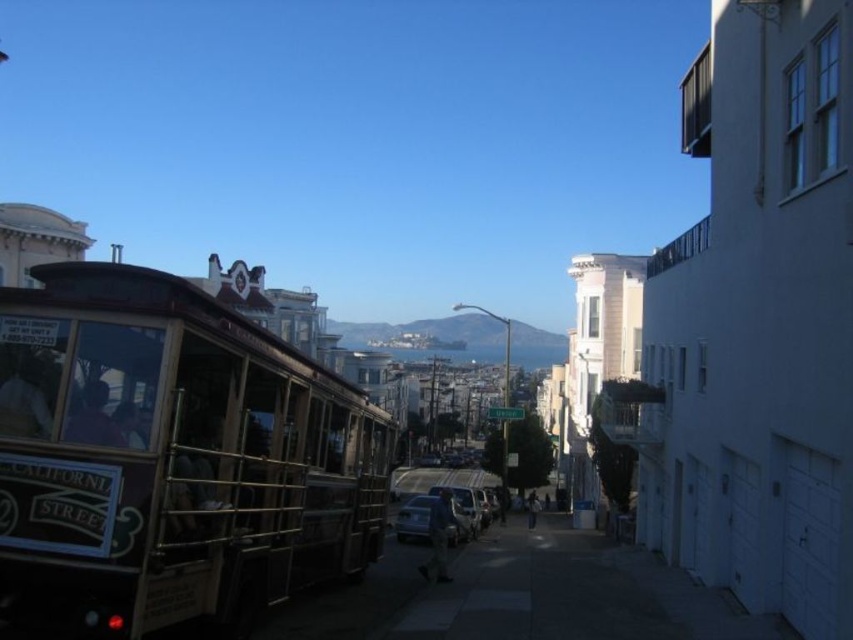
Based on the photo, you are a tour guide explaining the vehicles in the scene to a visitor. You mention both the wooden polished cable car at left and the satin silver sedan at center. Which vehicle is taller?

The wooden polished cable car at left is shorter than the satin silver sedan at center, so the satin silver sedan at center is taller.

You are a tourist standing on the sidewalk and want to take a photo of both the wooden polished cable car at left and the satin silver sedan at center without any obstructions. Which object should you position yourself behind to ensure both are visible in your shot?

You should position yourself behind the wooden polished cable car at left because it is positioned over the satin silver sedan at center, so standing behind it will allow you to see both vehicles without obstruction.

You are a tourist standing on the sidewalk and want to take a photo of both the wooden polished cable car at left and the satin silver sedan at center. Which object should you focus on first to ensure both are in the frame?

You should focus on the wooden polished cable car at left first because it is closer to you than the satin silver sedan at center. By focusing on the closer object, both will be in focus as the satin silver sedan at center is further away but still within the depth of field.